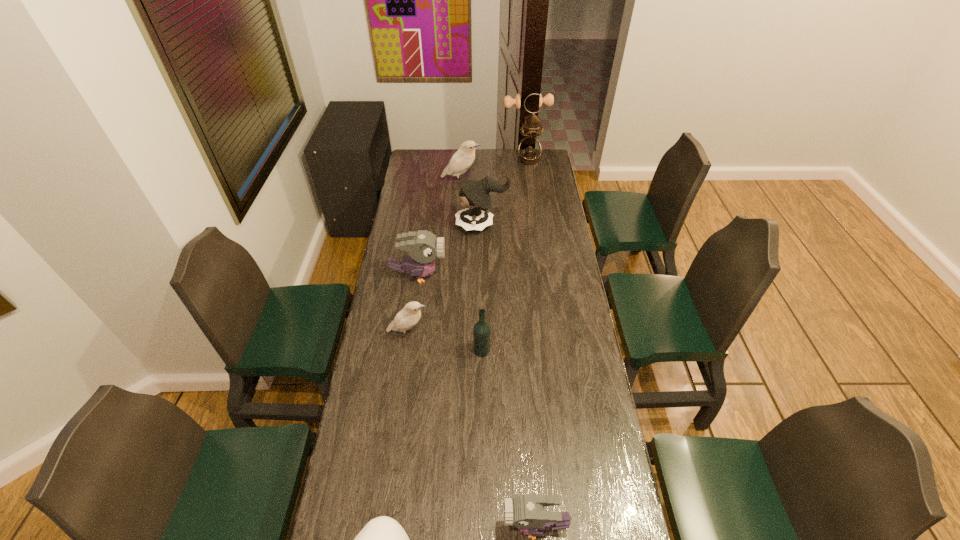
Where is `vacant space at the far left corner`? This screenshot has width=960, height=540. vacant space at the far left corner is located at coordinates (418, 167).

Where is `free region at the far right corner of the desktop`? This screenshot has height=540, width=960. free region at the far right corner of the desktop is located at coordinates [x=552, y=166].

I want to click on unoccupied area between the bigger gray bird and the doll, so click(x=450, y=251).

At what (x,y) coordinates should I click in order to perform the action: click on free space that is in between the farther gray bird and the vodka. Please return your answer as a coordinate pair (x, y). The width and height of the screenshot is (960, 540). Looking at the image, I should click on (450, 313).

I want to click on unoccupied position between the sixth nearest object and the farthest object, so click(506, 193).

Identify the location of vacant area that lies between the rightmost bird and the nearer white bird. (471, 430).

Find the location of a particular element. unoccupied position between the right gray bird and the fourth nearest object is located at coordinates (471, 430).

In order to click on object that is the sixth closest to the bigger white bird in this screenshot , I will do `click(526, 512)`.

Identify the location of object that ranks as the second closest to the white baseball cap. This screenshot has height=540, width=960. (481, 331).

Select which bird is the closest to the third farthest object. Please provide its 2D coordinates. Your answer should be formatted as a tuple, i.e. [(x, y)], where the tuple contains the x and y coordinates of a point satisfying the conditions above.

[(423, 246)]